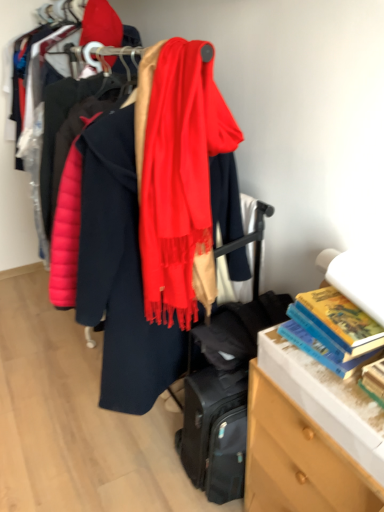
You are a GUI agent. You are given a task and a screenshot of the screen. Output one action in this format:
    pyautogui.click(x=<x>, y=<y>)
    Task: Click on the vacant point above hardcover book at right, the 1th book positioned from the back (from a real-world perspective)
    The image size is (384, 512).
    Given the screenshot: What is the action you would take?
    pyautogui.click(x=338, y=310)